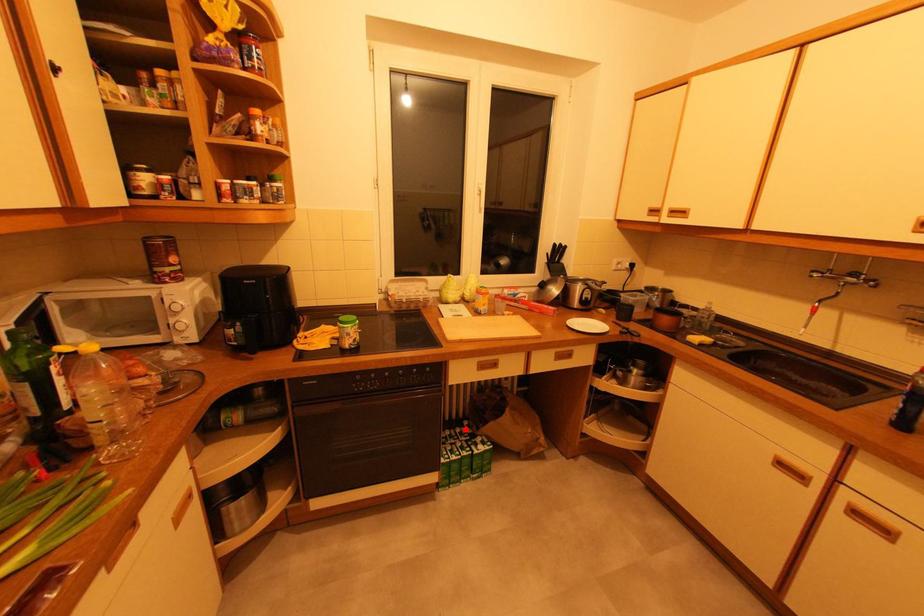
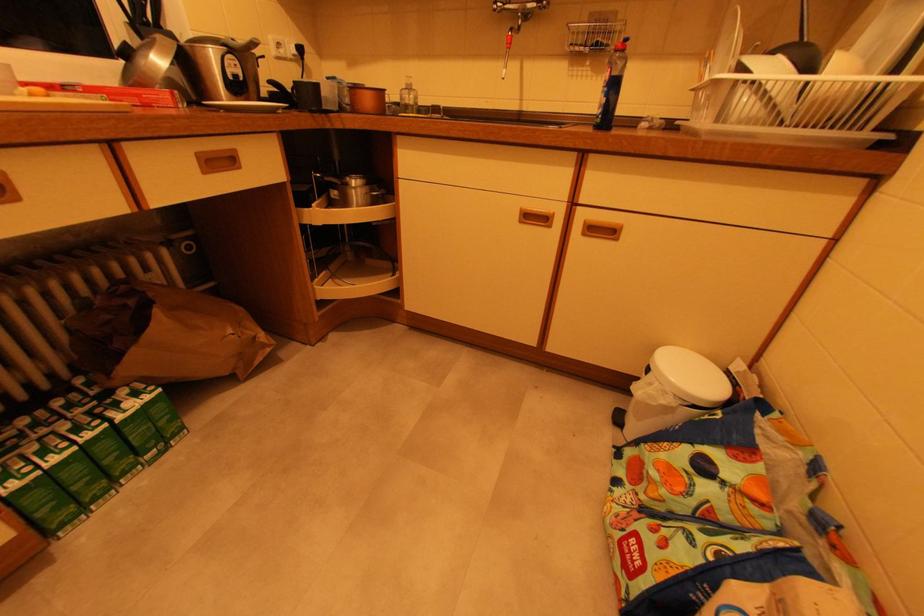
Where in the second image is the point corresponding to the highlighted location from the first image?

(78, 395)